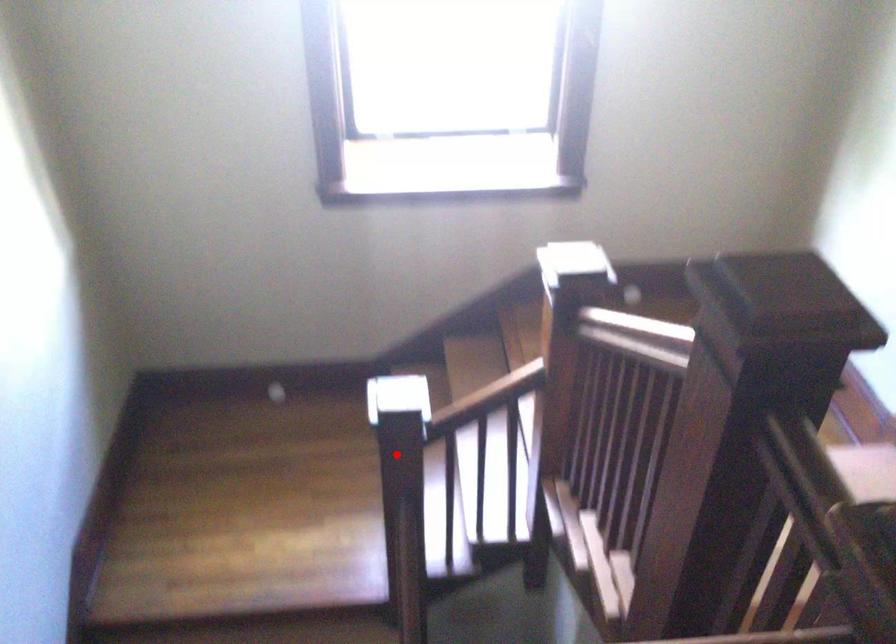
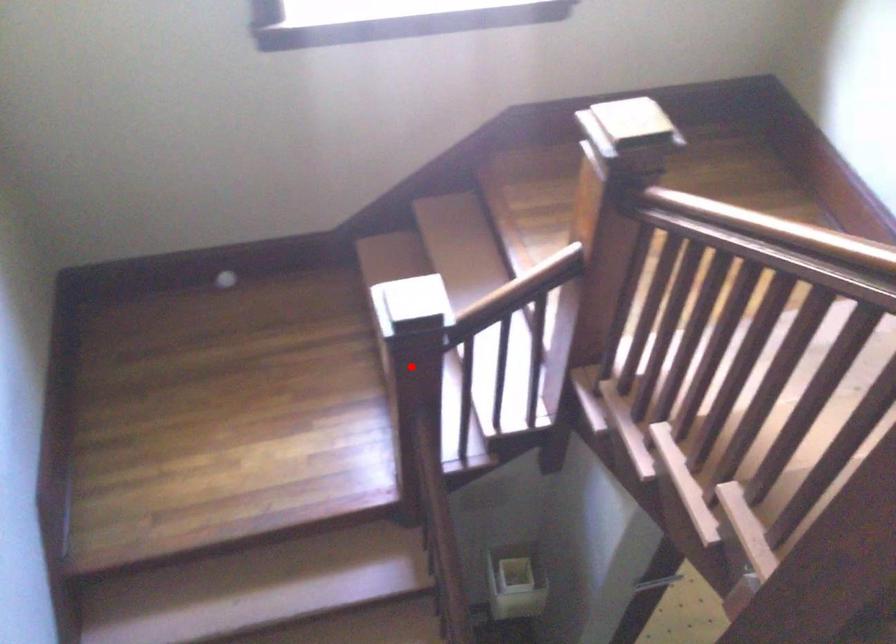
I am providing you with two images of the same scene from different viewpoints. A red point is marked on the first image and another point is marked on the second image. Do the highlighted points in image1 and image2 indicate the same real-world spot?

Yes